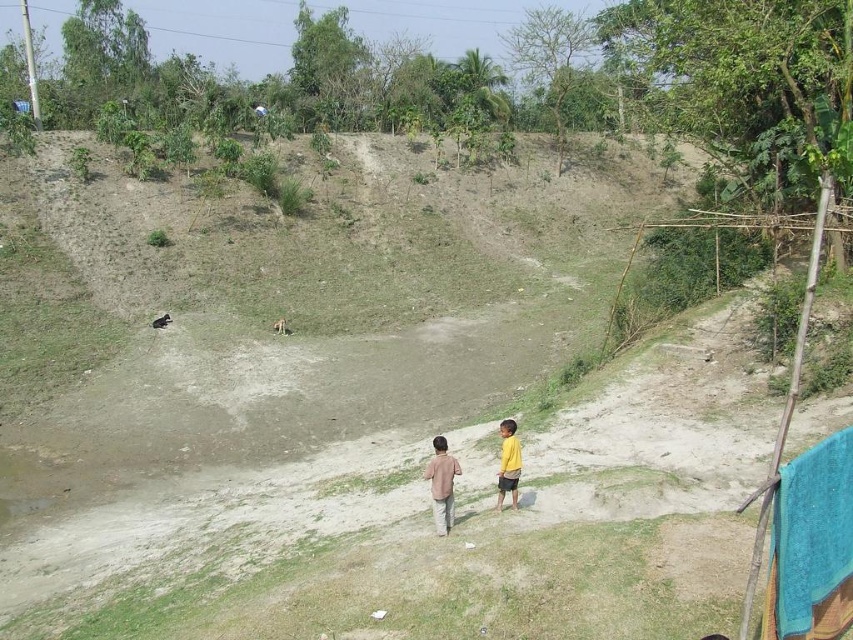
Where is the brown cotton shirt at center located in the image?

The brown cotton shirt at center is located at point (442,484) in the image.

You are a photographer trying to capture both the light brown cotton shirt at center and the yellow matte shirt at lower right in the same frame. Which shirt should you position your camera closer to in order to include both shirts without zooming in?

You should position your camera closer to the yellow matte shirt at lower right because the light brown cotton shirt at center is to the left of it, so moving closer to the yellow matte shirt at lower right will help capture both shirts in the frame without zooming in.